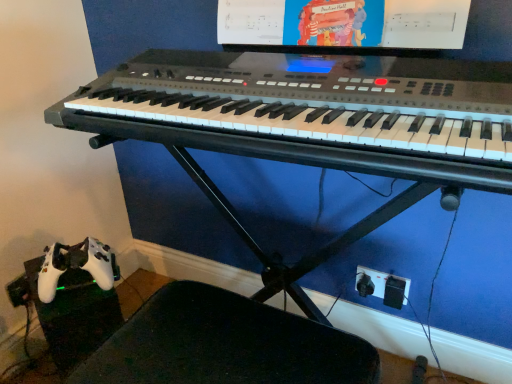
Question: From a real-world perspective, is matte plastic computer monitor at upper center located beneath black plastic swivel chair at lower left?

Choices:
 (A) yes
 (B) no

Answer: (B)

Question: Does matte plastic computer monitor at upper center have a smaller size compared to black plastic swivel chair at lower left?

Choices:
 (A) no
 (B) yes

Answer: (B)

Question: Can you confirm if matte plastic computer monitor at upper center is taller than black plastic swivel chair at lower left?

Choices:
 (A) yes
 (B) no

Answer: (B)

Question: Could you tell me if matte plastic computer monitor at upper center is turned towards black plastic swivel chair at lower left?

Choices:
 (A) yes
 (B) no

Answer: (B)

Question: Could black plastic swivel chair at lower left be considered to be inside matte plastic computer monitor at upper center?

Choices:
 (A) no
 (B) yes

Answer: (A)

Question: Can you confirm if matte plastic computer monitor at upper center is positioned to the right of black plastic swivel chair at lower left?

Choices:
 (A) no
 (B) yes

Answer: (B)

Question: Is matte plastic computer monitor at upper center not close to satin black keyboard at center?

Choices:
 (A) yes
 (B) no

Answer: (B)

Question: Is matte plastic computer monitor at upper center at the left side of satin black keyboard at center?

Choices:
 (A) yes
 (B) no

Answer: (B)

Question: From a real-world perspective, is matte plastic computer monitor at upper center on satin black keyboard at center?

Choices:
 (A) no
 (B) yes

Answer: (B)

Question: Can you confirm if matte plastic computer monitor at upper center is positioned to the right of satin black keyboard at center?

Choices:
 (A) no
 (B) yes

Answer: (B)

Question: Considering the relative positions of matte plastic computer monitor at upper center and satin black keyboard at center in the image provided, is matte plastic computer monitor at upper center behind satin black keyboard at center?

Choices:
 (A) no
 (B) yes

Answer: (B)

Question: From the image's perspective, is matte plastic computer monitor at upper center above satin black keyboard at center?

Choices:
 (A) yes
 (B) no

Answer: (A)

Question: Is black plastic plug at lower right behind matte plastic computer monitor at upper center?

Choices:
 (A) no
 (B) yes

Answer: (B)